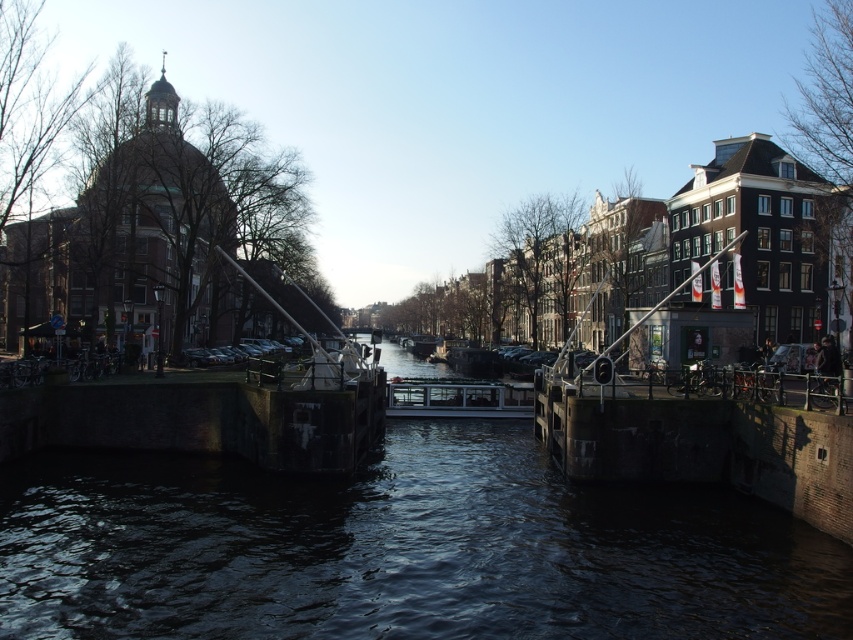
You are a passenger on the metallic glass boat at center. You want to know if the dark concrete water at center is beneath you. Is it?

Yes, the dark concrete water at center is positioned under the metallic glass boat at center, so it is beneath you.

You are standing at the edge of the canal and want to take a photo. There are two points of interest marked in the scene. The first is at point coordinates point (335,481), and the second is at point (488,417). Which point is closer to you, the photographer?

Point (335,481) is closer to the camera than point (488,417), so the first point is closer to you.